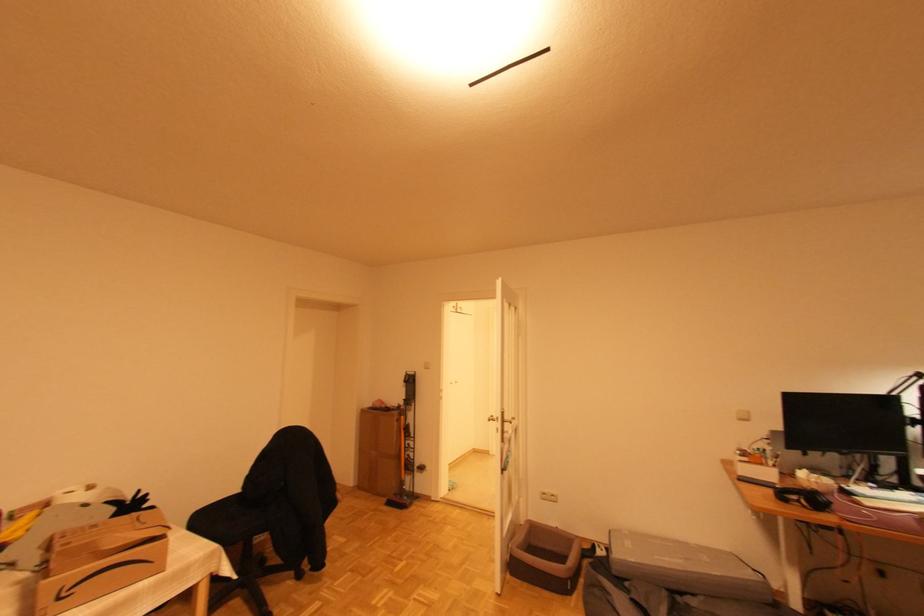
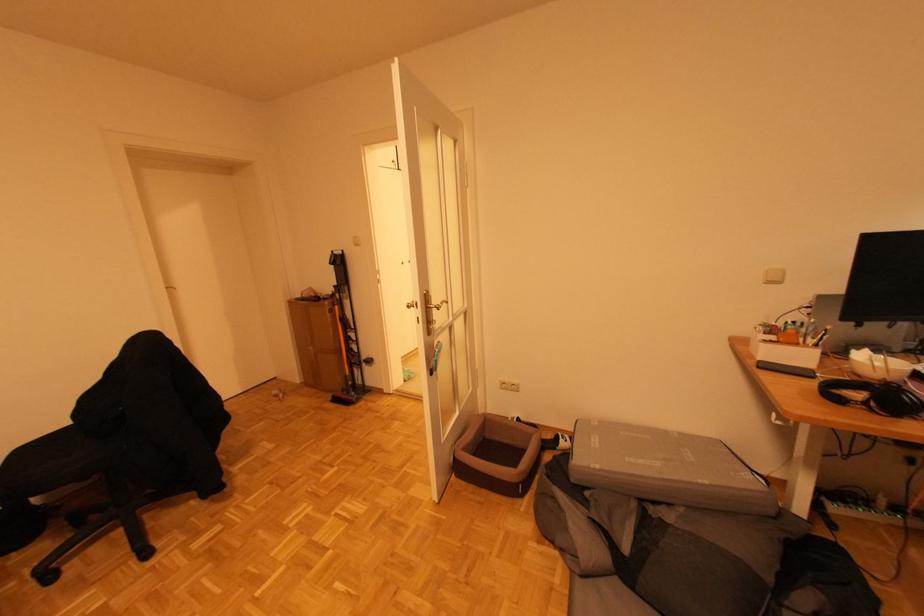
Question: The first image is from the beginning of the video and the second image is from the end. How did the camera likely rotate when shooting the video?

Choices:
 (A) Left
 (B) Right
 (C) Up
 (D) Down

Answer: (D)